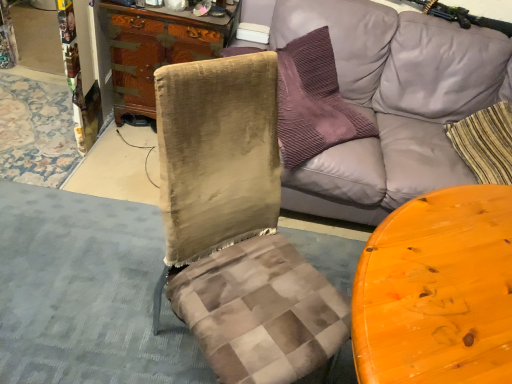
Question: Can you confirm if gray fabric couch at upper right is positioned to the right of wooden cabinet at center?

Choices:
 (A) yes
 (B) no

Answer: (A)

Question: Is gray fabric couch at upper right positioned in front of wooden cabinet at center?

Choices:
 (A) yes
 (B) no

Answer: (A)

Question: Can you confirm if gray fabric couch at upper right is shorter than wooden cabinet at center?

Choices:
 (A) no
 (B) yes

Answer: (A)

Question: Is gray fabric couch at upper right aimed at wooden cabinet at center?

Choices:
 (A) no
 (B) yes

Answer: (A)

Question: Is gray fabric couch at upper right oriented away from wooden cabinet at center?

Choices:
 (A) yes
 (B) no

Answer: (B)

Question: Considering the relative sizes of gray fabric couch at upper right and wooden cabinet at center in the image provided, is gray fabric couch at upper right wider than wooden cabinet at center?

Choices:
 (A) yes
 (B) no

Answer: (A)

Question: Considering the relative sizes of wooden cabinet at center and gray fabric couch at upper right in the image provided, is wooden cabinet at center wider than gray fabric couch at upper right?

Choices:
 (A) no
 (B) yes

Answer: (A)

Question: Is wooden cabinet at center to the right of gray fabric couch at upper right from the viewer's perspective?

Choices:
 (A) no
 (B) yes

Answer: (A)

Question: Is wooden cabinet at center behind gray fabric couch at upper right?

Choices:
 (A) yes
 (B) no

Answer: (A)

Question: Are wooden cabinet at center and gray fabric couch at upper right making contact?

Choices:
 (A) yes
 (B) no

Answer: (B)

Question: From the image's perspective, does wooden cabinet at center appear lower than gray fabric couch at upper right?

Choices:
 (A) no
 (B) yes

Answer: (A)

Question: Is wooden cabinet at center closer to the viewer compared to gray fabric couch at upper right?

Choices:
 (A) no
 (B) yes

Answer: (A)

Question: In terms of size, does gray fabric couch at upper right appear bigger or smaller than wooden cabinet at center?

Choices:
 (A) small
 (B) big

Answer: (B)